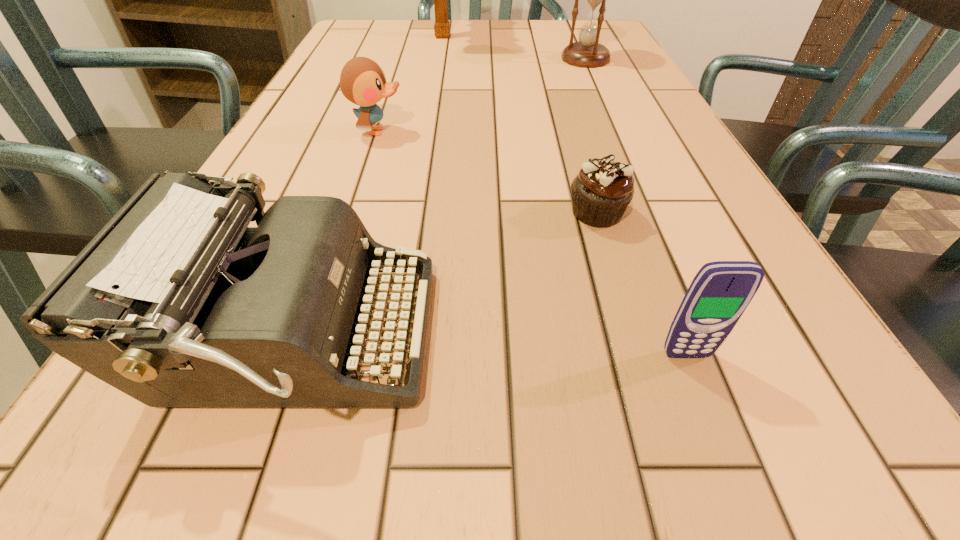
Image resolution: width=960 pixels, height=540 pixels. In the image, there is a desktop. What are the coordinates of `vacant space at the right edge` in the screenshot? It's located at (663, 115).

The height and width of the screenshot is (540, 960). In order to click on vacant space at the far left corner of the desktop in this screenshot , I will do `click(378, 31)`.

The height and width of the screenshot is (540, 960). I want to click on free area in between the second tallest object and the duck, so click(x=482, y=95).

You are a GUI agent. You are given a task and a screenshot of the screen. Output one action in this format:
    pyautogui.click(x=<x>, y=<y>)
    Task: Click on the empty location between the fourth farthest object and the hourglass
    Image resolution: width=960 pixels, height=540 pixels.
    Given the screenshot: What is the action you would take?
    pyautogui.click(x=591, y=136)

Where is `free space between the third farthest object and the cupcake`? This screenshot has height=540, width=960. free space between the third farthest object and the cupcake is located at coordinates (488, 172).

You are a GUI agent. You are given a task and a screenshot of the screen. Output one action in this format:
    pyautogui.click(x=<x>, y=<y>)
    Task: Click on the unoccupied area between the shortest object and the cellular telephone
    The height and width of the screenshot is (540, 960).
    Given the screenshot: What is the action you would take?
    pyautogui.click(x=641, y=284)

You are a GUI agent. You are given a task and a screenshot of the screen. Output one action in this format:
    pyautogui.click(x=<x>, y=<y>)
    Task: Click on the free spot between the typewriter and the cellular telephone
    
    Given the screenshot: What is the action you would take?
    pyautogui.click(x=491, y=346)

You are a GUI agent. You are given a task and a screenshot of the screen. Output one action in this format:
    pyautogui.click(x=<x>, y=<y>)
    Task: Click on the unoccupied area between the cupcake and the mallet
    The width and height of the screenshot is (960, 540).
    Given the screenshot: What is the action you would take?
    pyautogui.click(x=519, y=124)

Identify the location of free spot between the cellular telephone and the fourth nearest object. The image size is (960, 540). (532, 243).

Where is `free space between the cellular telephone and the hourglass`? free space between the cellular telephone and the hourglass is located at coordinates (636, 207).